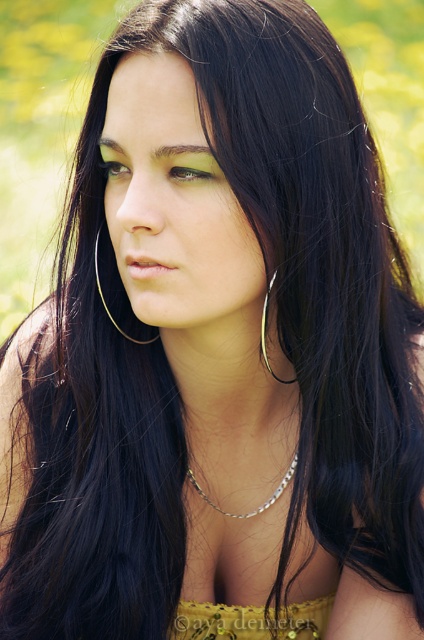
Question: Observing the image, what is the correct spatial positioning of yellow lace dress at center in reference to brown matte eye at center?

Choices:
 (A) above
 (B) below

Answer: (B)

Question: Among these points, which one is nearest to the camera?

Choices:
 (A) (245, 515)
 (B) (102, 292)
 (C) (292, 381)
 (D) (98, 164)

Answer: (D)

Question: Considering the real-world distances, which object is farthest from the silver metallic hoop earring at center-left?

Choices:
 (A) brown shiny eye at upper center
 (B) yellow lace dress at center
 (C) gold metallic hoop at center

Answer: (B)

Question: Can you confirm if brown matte eye at center is positioned to the right of silver metallic hoop earring at center-left?

Choices:
 (A) no
 (B) yes

Answer: (A)

Question: Estimate the real-world distances between objects in this image. Which object is farther from the silver metallic chain at center?

Choices:
 (A) gold metallic hoop at center
 (B) yellow lace dress at center
 (C) silver metallic hoop earring at center-left

Answer: (A)

Question: Observing the image, what is the correct spatial positioning of yellow lace dress at center in reference to brown matte eye at center?

Choices:
 (A) left
 (B) right

Answer: (B)